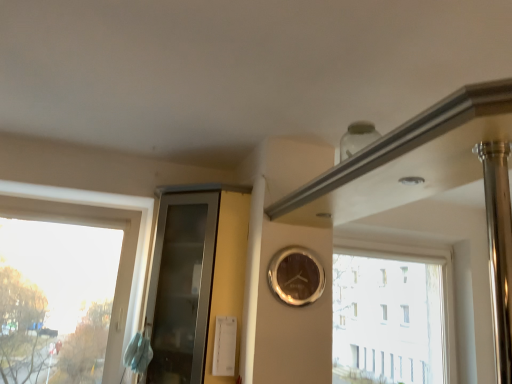
Question: Is shiny gold clock at center further to the viewer compared to transparent glass window at left, which ranks as the second window in right-to-left order?

Choices:
 (A) yes
 (B) no

Answer: (B)

Question: Considering the relative sizes of shiny gold clock at center and transparent glass window at left, the 1th window in the left-to-right sequence, in the image provided, is shiny gold clock at center thinner than transparent glass window at left, the 1th window in the left-to-right sequence,?

Choices:
 (A) yes
 (B) no

Answer: (A)

Question: Is shiny gold clock at center placed right next to transparent glass window at left, which ranks as the second window in right-to-left order?

Choices:
 (A) no
 (B) yes

Answer: (A)

Question: Is shiny gold clock at center at the left side of transparent glass window at left, which ranks as the second window in right-to-left order?

Choices:
 (A) yes
 (B) no

Answer: (B)

Question: From a real-world perspective, is shiny gold clock at center located higher than transparent glass window at left, the 1th window in the left-to-right sequence?

Choices:
 (A) no
 (B) yes

Answer: (B)

Question: From the image's perspective, is transparent glass window at left, which is the second window from back to front, above or below shiny gold clock at center?

Choices:
 (A) below
 (B) above

Answer: (A)

Question: Which is correct: transparent glass window at left, which ranks as the second window in right-to-left order, is inside shiny gold clock at center, or outside of it?

Choices:
 (A) inside
 (B) outside

Answer: (B)

Question: Is transparent glass window at left, which is the second window from back to front, bigger or smaller than shiny gold clock at center?

Choices:
 (A) small
 (B) big

Answer: (B)

Question: Visually, is transparent glass window at left, acting as the 1th window starting from the front, positioned to the left or to the right of shiny gold clock at center?

Choices:
 (A) left
 (B) right

Answer: (A)

Question: From the image's perspective, is shiny gold clock at center above or below transparent glass window at upper right, placed as the first window when sorted from right to left?

Choices:
 (A) below
 (B) above

Answer: (B)

Question: Considering the positions of shiny gold clock at center and transparent glass window at upper right, the second window when ordered from left to right, in the image, is shiny gold clock at center wider or thinner than transparent glass window at upper right, the second window when ordered from left to right,?

Choices:
 (A) wide
 (B) thin

Answer: (B)

Question: From a real-world perspective, is shiny gold clock at center above or below transparent glass window at upper right, placed as the first window when sorted from right to left?

Choices:
 (A) below
 (B) above

Answer: (B)

Question: Does point (309, 261) appear closer or farther from the camera than point (339, 360)?

Choices:
 (A) closer
 (B) farther

Answer: (A)

Question: In the image, is transparent glass window at upper right, the 1th window in the back-to-front sequence, positioned in front of or behind shiny gold clock at center?

Choices:
 (A) behind
 (B) front

Answer: (A)

Question: Is transparent glass window at upper right, placed as the first window when sorted from right to left, inside the boundaries of shiny gold clock at center, or outside?

Choices:
 (A) inside
 (B) outside

Answer: (B)